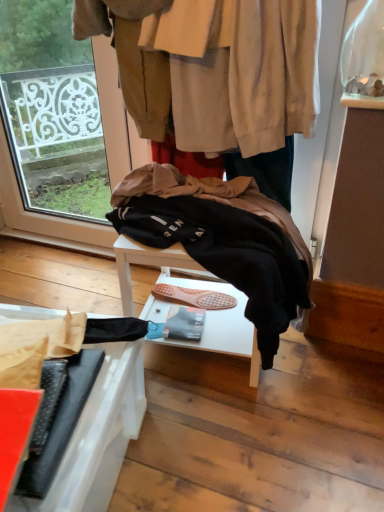
What do you see at coordinates (266, 170) in the screenshot? This screenshot has width=384, height=512. I see `dark blue jeans at center` at bounding box center [266, 170].

You are a GUI agent. You are given a task and a screenshot of the screen. Output one action in this format:
    pyautogui.click(x=<x>, y=<y>)
    Task: Click on the dark blue jeans at center
    This screenshot has width=384, height=512.
    Given the screenshot: What is the action you would take?
    pyautogui.click(x=266, y=170)

Is black fleece jacket at center turned away from black matte umbrella at lower left?

black fleece jacket at center does not have its back to black matte umbrella at lower left.

In terms of width, does black fleece jacket at center look wider or thinner when compared to black matte umbrella at lower left?

Considering their sizes, black fleece jacket at center looks slimmer than black matte umbrella at lower left.

Between black fleece jacket at center and black matte umbrella at lower left, which one has more height?

Standing taller between the two is black fleece jacket at center.

Is black fleece jacket at center not close to black matte umbrella at lower left?

No, black fleece jacket at center is in close proximity to black matte umbrella at lower left.

Locate an element on the screen. This screenshot has width=384, height=512. furniture on the left of black fleece jacket at center is located at coordinates (98, 435).

Does black matte umbrella at lower left touch black fleece jacket at center?

No, black matte umbrella at lower left is not with black fleece jacket at center.

Could you tell me if black matte umbrella at lower left is turned towards black fleece jacket at center?

No, black matte umbrella at lower left does not turn towards black fleece jacket at center.

Does point (275, 187) come behind point (207, 226)?

Yes.

How far apart are dark blue jeans at center and black fleece jacket at center?

They are 8.44 inches apart.

How different are the orientations of dark blue jeans at center and black fleece jacket at center in degrees?

The angular difference between dark blue jeans at center and black fleece jacket at center is 0.0278 degrees.

Which of these two, dark blue jeans at center or black fleece jacket at center, is wider?

black fleece jacket at center is wider.

Would you say black matte umbrella at lower left is part of dark blue jeans at center's contents?

Actually, black matte umbrella at lower left is outside dark blue jeans at center.

Can you confirm if dark blue jeans at center is shorter than black matte umbrella at lower left?

Indeed, dark blue jeans at center has a lesser height compared to black matte umbrella at lower left.

Considering the sizes of objects dark blue jeans at center and black matte umbrella at lower left in the image provided, who is smaller, dark blue jeans at center or black matte umbrella at lower left?

Smaller between the two is dark blue jeans at center.

Looking at this image, from the image's perspective, is dark blue jeans at center above black matte umbrella at lower left?

Indeed, from the image's perspective, dark blue jeans at center is shown above black matte umbrella at lower left.

The image size is (384, 512). Identify the location of trousers that is above the black matte umbrella at lower left (from the image's perspective). (266, 170).

Which object is more forward, black matte umbrella at lower left or dark blue jeans at center?

black matte umbrella at lower left is in front.

Considering the relative sizes of black matte umbrella at lower left and dark blue jeans at center in the image provided, is black matte umbrella at lower left thinner than dark blue jeans at center?

No.

Considering the positions of objects black matte umbrella at lower left and dark blue jeans at center in the image provided, who is more to the right, black matte umbrella at lower left or dark blue jeans at center?

dark blue jeans at center.

Which is closer to the camera, (220,275) or (243,175)?

Point (220,275).

Consider the image. Between black fleece jacket at center and dark blue jeans at center, which one has more height?

black fleece jacket at center is taller.

From the image's perspective, is black fleece jacket at center above or below dark blue jeans at center?

Clearly, from the image's perspective, black fleece jacket at center is below dark blue jeans at center.

Where is `wool above the black matte umbrella at lower left (from a real-world perspective)`? The width and height of the screenshot is (384, 512). wool above the black matte umbrella at lower left (from a real-world perspective) is located at coordinates [x=224, y=241].

Locate an element on the screen. This screenshot has height=512, width=384. wool on the right side of black matte umbrella at lower left is located at coordinates (224, 241).

From the image, which object appears to be nearer to black fleece jacket at center, black matte umbrella at lower left or dark blue jeans at center?

dark blue jeans at center.

Considering their positions, is dark blue jeans at center positioned further to black fleece jacket at center than black matte umbrella at lower left?

The object further to black fleece jacket at center is black matte umbrella at lower left.

In the scene shown: Which object lies further to the anchor point black matte umbrella at lower left, dark blue jeans at center or black fleece jacket at center?

dark blue jeans at center lies further to black matte umbrella at lower left than the other object.

From the image, which object appears to be nearer to black matte umbrella at lower left, black fleece jacket at center or dark blue jeans at center?

black fleece jacket at center lies closer to black matte umbrella at lower left than the other object.

From the image, which object appears to be nearer to dark blue jeans at center, black fleece jacket at center or black matte umbrella at lower left?

black fleece jacket at center.

Consider the image. Which object lies further to the anchor point dark blue jeans at center, black matte umbrella at lower left or black fleece jacket at center?

black matte umbrella at lower left is further to dark blue jeans at center.

Where is `wool between dark blue jeans at center and black matte umbrella at lower left in the up-down direction`? This screenshot has width=384, height=512. wool between dark blue jeans at center and black matte umbrella at lower left in the up-down direction is located at coordinates (224, 241).